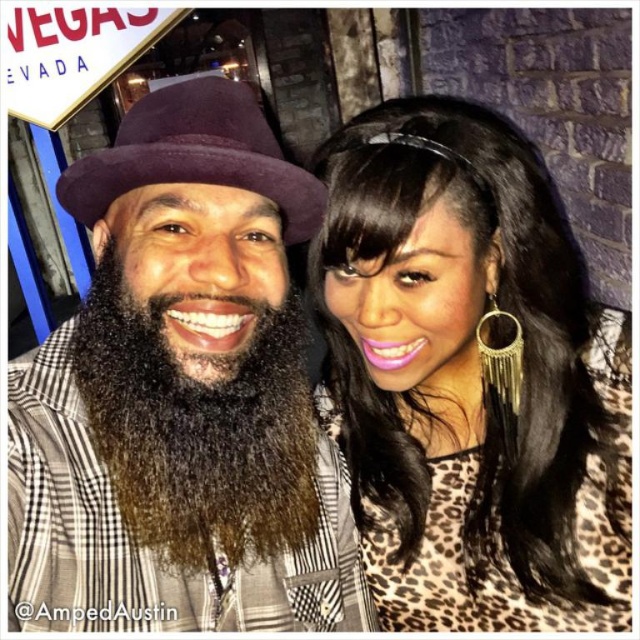
What are the coordinates of the leopard print blouse at center in the image?

The leopard print blouse at center is located at coordinates (472, 378).

Consider the image. You are a photographer adjusting the camera focus. The leopard print blouse at center and the dark brown fuzzy beard at center are both in the frame. Which object should you focus on first if you want to ensure the larger one is sharp?

The leopard print blouse at center should be focused on first since it has a larger size compared to the dark brown fuzzy beard at center.